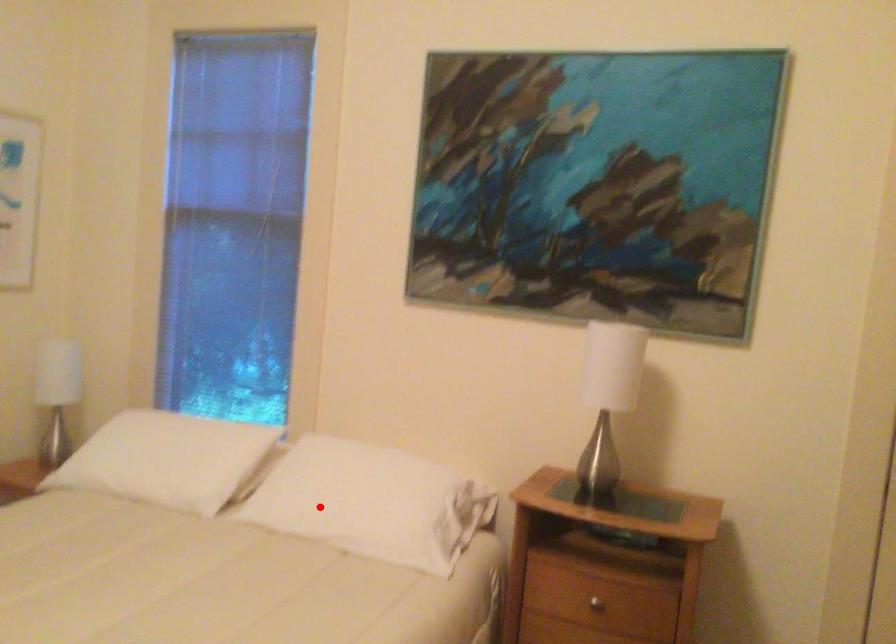
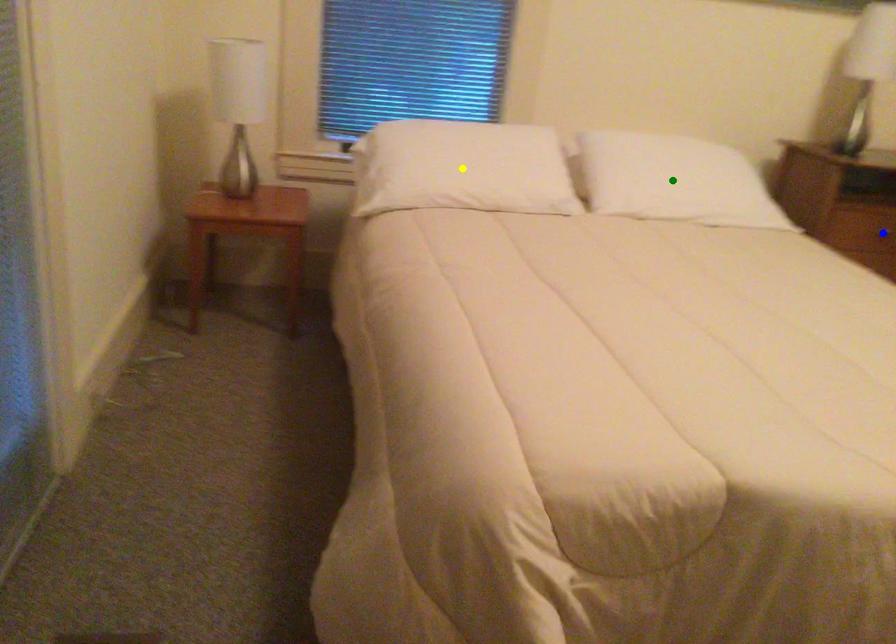
Question: I am providing you with two images of the same scene from different viewpoints. A red point is marked on the first image. You are given multiple points on the second image. Which point in image 2 is actually the same real-world point as the red point in image 1?

Choices:
 (A) blue point
 (B) yellow point
 (C) green point

Answer: (C)